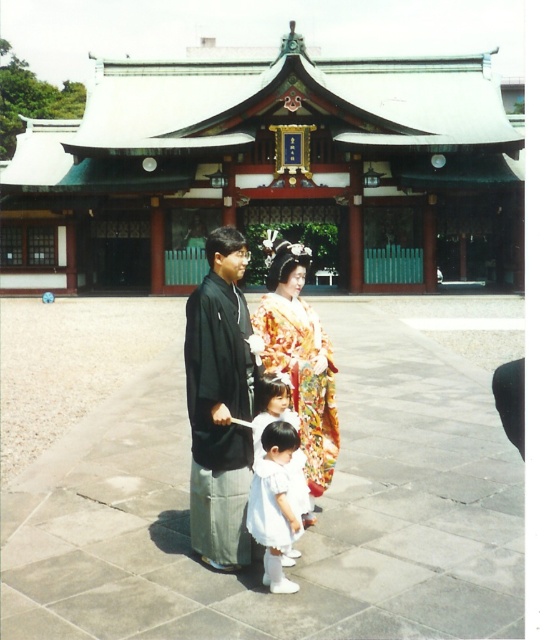
You are planning to take a photo of the black matte kimono at center and the white satin dress at lower center. Which one should you focus on first if you want to capture both in the same frame without moving the camera?

The black matte kimono at center is above the white satin dress at lower center, so you should focus on the white satin dress at lower center first as it is closer to the camera and adjust the focus to include the black matte kimono at center in the background.

You are a photographer planning to take a group photo of the silk kimono at center and the white satin dress at lower center. Based on their positions, which one should you place closer to the front to ensure both are fully visible in the photo?

The silk kimono at center is taller than the white satin dress at lower center, so you should place the silk kimono at center closer to the front to ensure both are fully visible in the photo.